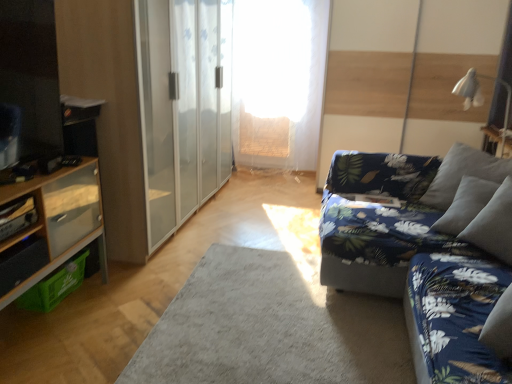
Find the location of `vacant space underneath transparent fabric at center (from a real-world perspective)`. vacant space underneath transparent fabric at center (from a real-world perspective) is located at coordinates (275, 173).